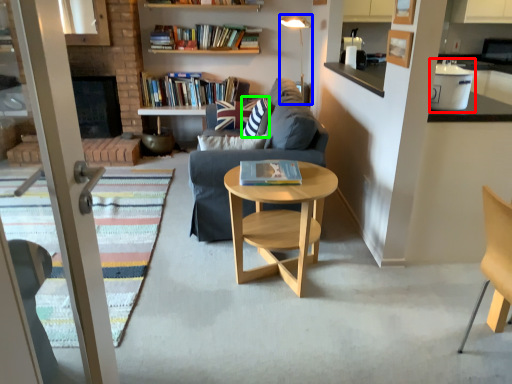
Question: Estimate the real-world distances between objects in this image. Which object is farther from appliance (highlighted by a red box), lamp (highlighted by a blue box) or pillow (highlighted by a green box)?

Choices:
 (A) lamp
 (B) pillow

Answer: (A)